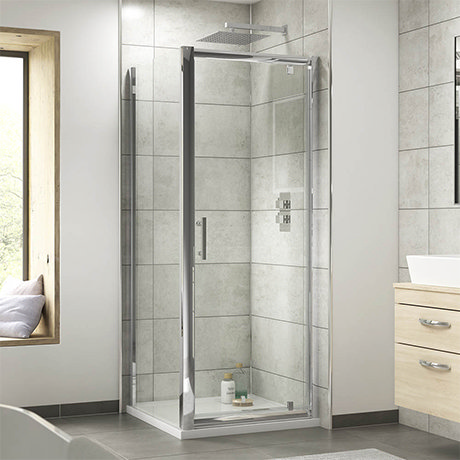
Where is `door`? door is located at coordinates (258, 186).